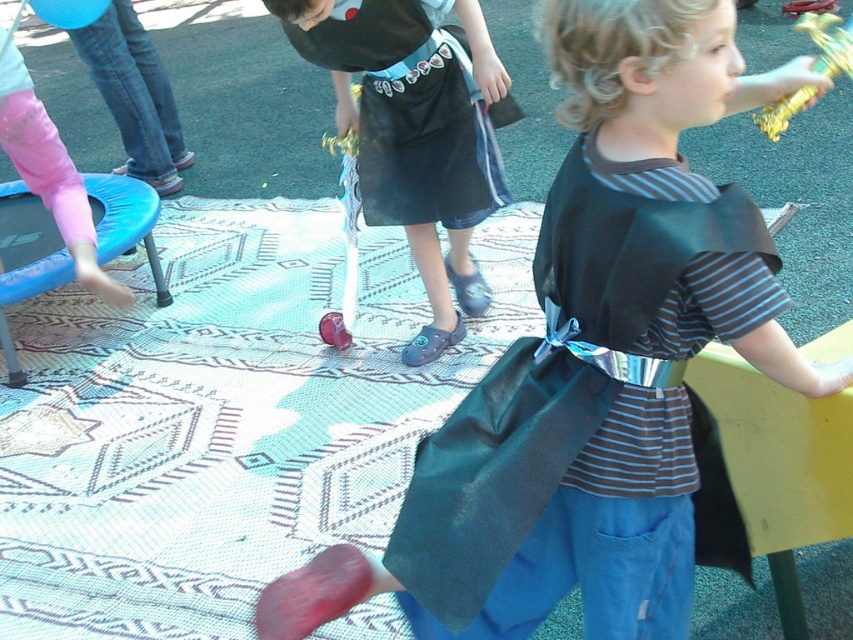
Is shiny dark green cape at center below gold metallic wand at upper right?

Indeed, shiny dark green cape at center is positioned under gold metallic wand at upper right.

This screenshot has width=853, height=640. Describe the element at coordinates (550, 380) in the screenshot. I see `shiny dark green cape at center` at that location.

In order to click on shiny dark green cape at center in this screenshot , I will do (x=550, y=380).

Between shiny dark green cape at center and pink fleece pants at lower left, which one appears on the left side from the viewer's perspective?

From the viewer's perspective, pink fleece pants at lower left appears more on the left side.

Which is more to the right, shiny dark green cape at center or pink fleece pants at lower left?

shiny dark green cape at center is more to the right.

Where is `shiny dark green cape at center`? This screenshot has width=853, height=640. shiny dark green cape at center is located at coordinates (550, 380).

Does blue plastic stool at lower left have a larger size compared to gold metallic wand at upper right?

Correct, blue plastic stool at lower left is larger in size than gold metallic wand at upper right.

Is point (50, 282) closer to camera compared to point (799, 97)?

No, it is not.

Find the location of a particular element. The height and width of the screenshot is (640, 853). blue plastic stool at lower left is located at coordinates (128, 220).

I want to click on blue plastic stool at lower left, so click(128, 220).